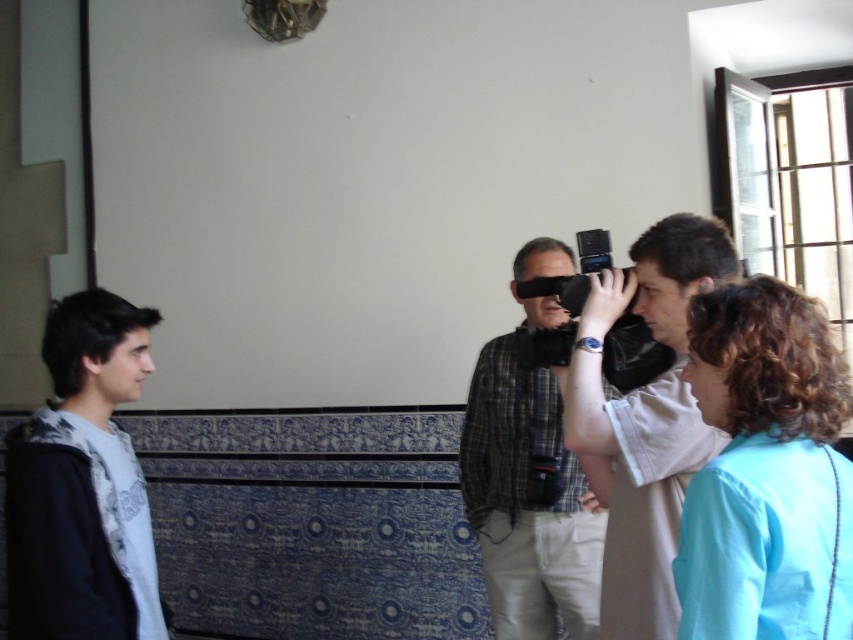
Question: Is light blue fabric at lower right closer to camera compared to light gray hoodie at left?

Choices:
 (A) yes
 (B) no

Answer: (A)

Question: Which of the following is the closest to the observer?

Choices:
 (A) matte black camera at center
 (B) light blue fabric at lower right

Answer: (B)

Question: Observing the image, what is the correct spatial positioning of light blue fabric at lower right in reference to plaid shirt at center?

Choices:
 (A) above
 (B) below

Answer: (A)

Question: Which of these objects is positioned closest to the plaid shirt at center?

Choices:
 (A) matte black camera at center
 (B) light blue fabric at lower right
 (C) light gray hoodie at left

Answer: (A)

Question: Can you confirm if matte black camera at center is positioned above plaid shirt at center?

Choices:
 (A) yes
 (B) no

Answer: (A)

Question: Estimate the real-world distances between objects in this image. Which object is farther from the light gray hoodie at left?

Choices:
 (A) matte black camera at center
 (B) plaid shirt at center
 (C) light blue fabric at lower right

Answer: (C)